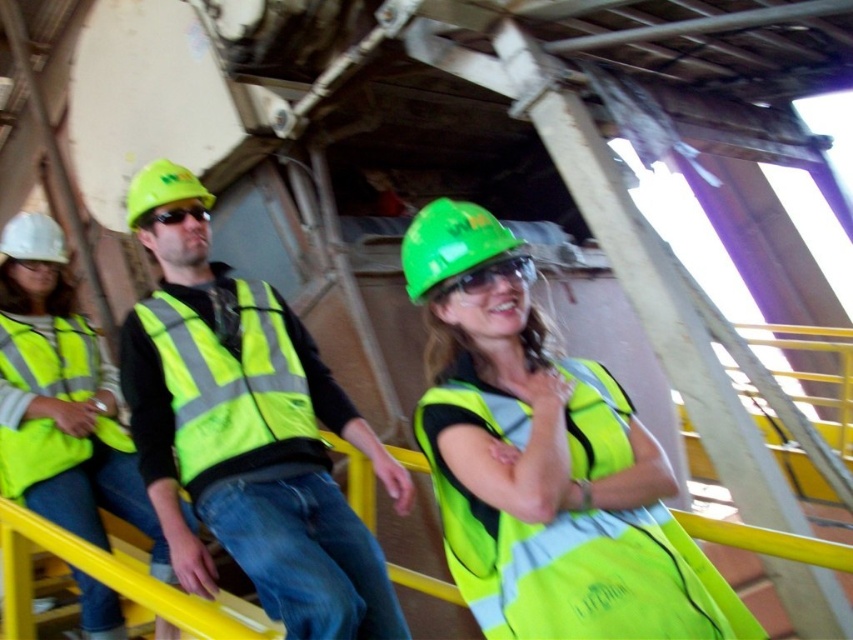
Question: Can you confirm if high-visibility reflective vest at center is wider than matte green goggles at center?

Choices:
 (A) no
 (B) yes

Answer: (B)

Question: Which point appears closest to the camera in this image?

Choices:
 (A) pos(483,285)
 (B) pos(177,285)
 (C) pos(439,243)

Answer: (A)

Question: Is neon yellow reflective vest at center wider than green matte safety goggles at center?

Choices:
 (A) yes
 (B) no

Answer: (A)

Question: Does high-visibility reflective vest at center appear on the right side of neon yellow reflective vest at center?

Choices:
 (A) no
 (B) yes

Answer: (B)

Question: Which point is farther to the camera?

Choices:
 (A) [183, 460]
 (B) [479, 291]
 (C) [0, 394]
 (D) [22, 465]

Answer: (C)

Question: Which of the following is the farthest from the observer?

Choices:
 (A) (158, 211)
 (B) (469, 284)
 (C) (138, 483)
 (D) (619, 596)

Answer: (C)